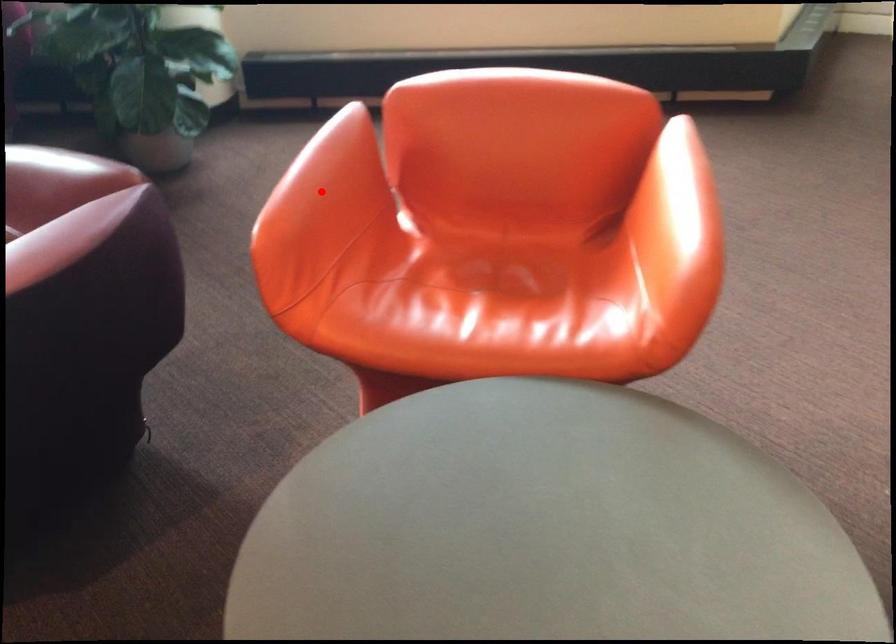
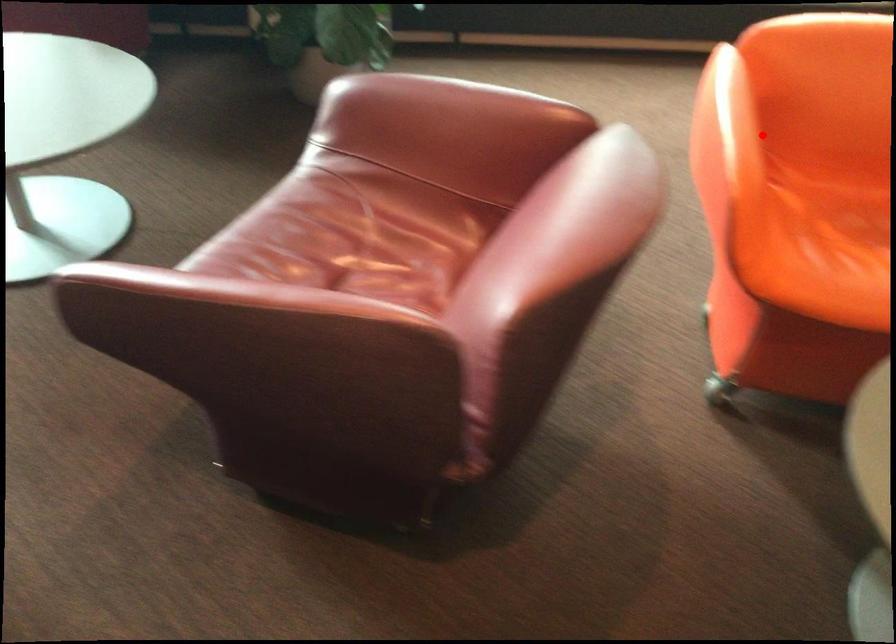
I am providing you with two images of the same scene from different viewpoints. A red point is marked on the first image and another point is marked on the second image. Does the point marked in image1 correspond to the same location as the one in image2?

Yes